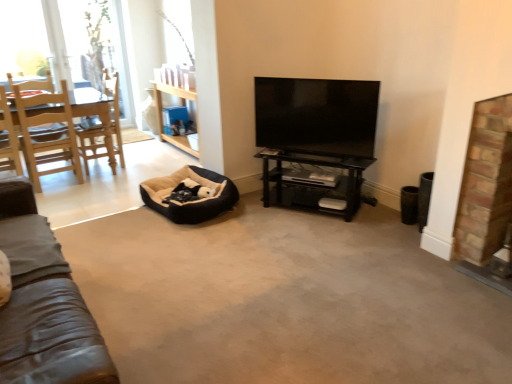
Question: Does brick fireplace at right have a larger size compared to black glossy shelf at center?

Choices:
 (A) no
 (B) yes

Answer: (A)

Question: Can you confirm if brick fireplace at right is positioned to the right of black glossy shelf at center?

Choices:
 (A) yes
 (B) no

Answer: (A)

Question: Would you consider brick fireplace at right to be distant from black glossy shelf at center?

Choices:
 (A) yes
 (B) no

Answer: (A)

Question: From a real-world perspective, is brick fireplace at right located beneath black glossy shelf at center?

Choices:
 (A) no
 (B) yes

Answer: (A)

Question: Considering the relative sizes of brick fireplace at right and black glossy shelf at center in the image provided, is brick fireplace at right taller than black glossy shelf at center?

Choices:
 (A) no
 (B) yes

Answer: (B)

Question: Considering the relative positions of brick fireplace at right and black glossy shelf at center in the image provided, is brick fireplace at right to the left of black glossy shelf at center from the viewer's perspective?

Choices:
 (A) no
 (B) yes

Answer: (A)

Question: Is the depth of brick fireplace at right greater than that of flat screen tv at center?

Choices:
 (A) yes
 (B) no

Answer: (B)

Question: Considering the relative sizes of brick fireplace at right and flat screen tv at center in the image provided, is brick fireplace at right taller than flat screen tv at center?

Choices:
 (A) yes
 (B) no

Answer: (A)

Question: Does brick fireplace at right have a larger size compared to flat screen tv at center?

Choices:
 (A) no
 (B) yes

Answer: (B)

Question: Can you confirm if brick fireplace at right is thinner than flat screen tv at center?

Choices:
 (A) no
 (B) yes

Answer: (A)

Question: Is the position of brick fireplace at right less distant than that of flat screen tv at center?

Choices:
 (A) no
 (B) yes

Answer: (B)

Question: Does brick fireplace at right contain flat screen tv at center?

Choices:
 (A) no
 (B) yes

Answer: (A)

Question: From the image's perspective, is wooden chair at left, the 1th chair positioned from the right, on black glossy shelf at center?

Choices:
 (A) no
 (B) yes

Answer: (B)